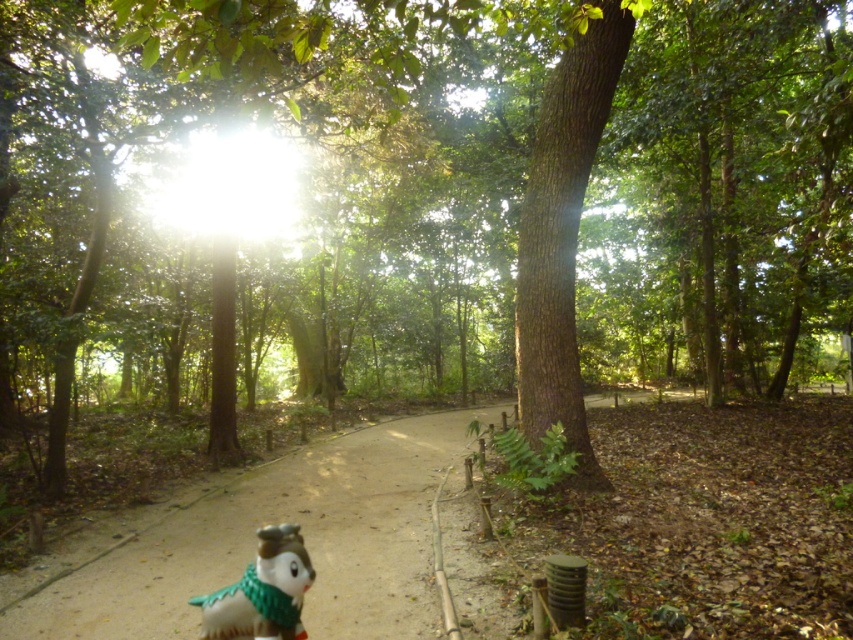
Question: Which of the following is the farthest from the observer?

Choices:
 (A) porcelain figurine at lower center
 (B) sandy dirt path at center

Answer: (B)

Question: In this image, where is sandy dirt path at center located relative to porcelain figurine at lower center?

Choices:
 (A) below
 (B) above

Answer: (A)

Question: Can you confirm if sandy dirt path at center is positioned below porcelain figurine at lower center?

Choices:
 (A) yes
 (B) no

Answer: (A)

Question: Does sandy dirt path at center appear over porcelain figurine at lower center?

Choices:
 (A) yes
 (B) no

Answer: (B)

Question: Which of the following is the closest to the observer?

Choices:
 (A) pos(3,579)
 (B) pos(258,636)

Answer: (B)

Question: Which point appears farthest from the camera in this image?

Choices:
 (A) (171, 528)
 (B) (264, 621)

Answer: (A)